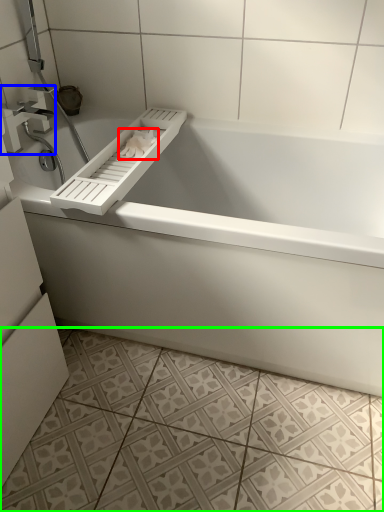
Question: Considering the real-world distances, which object is closest to toilet paper (highlighted by a red box)? tap (highlighted by a blue box) or ceramic tile (highlighted by a green box).

Choices:
 (A) tap
 (B) ceramic tile

Answer: (A)